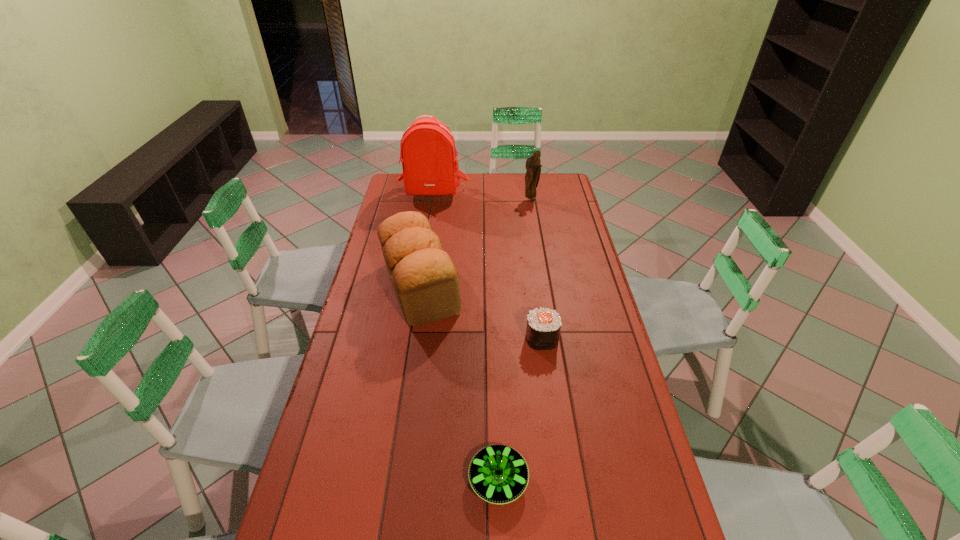
Locate an element on the screen. Image resolution: width=960 pixels, height=540 pixels. vacant space that satisfies the following two spatial constraints: 1. on the main compartment of the bread; 2. on the left side of the tallest object is located at coordinates (418, 287).